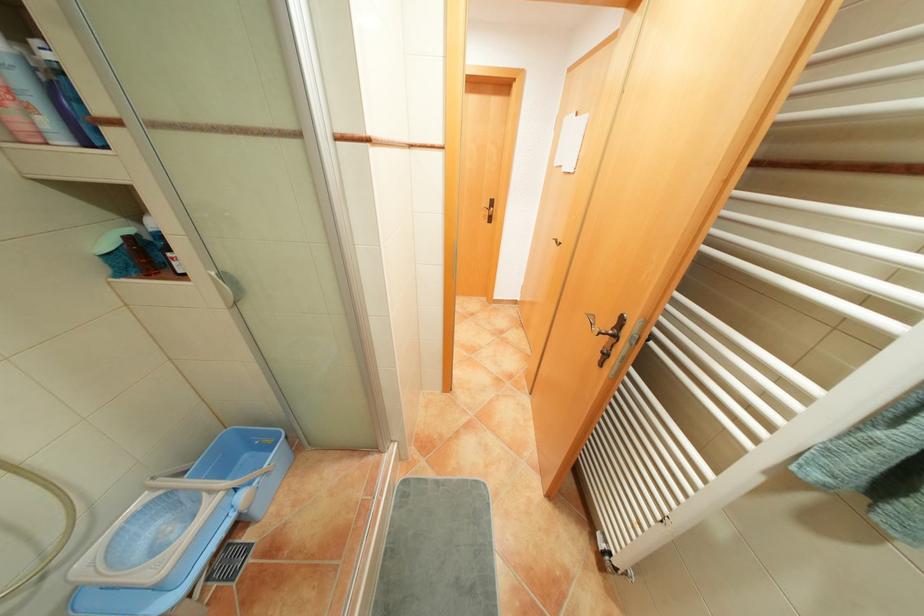
The image size is (924, 616). In order to click on bottle pump dispenser in this screenshot , I will do `click(140, 254)`.